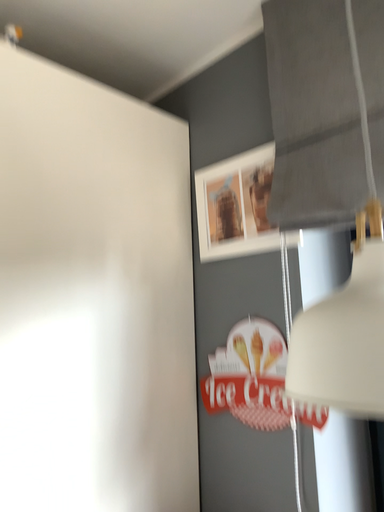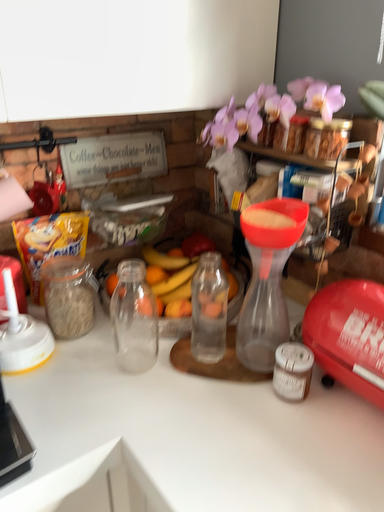
Question: How did the camera likely rotate when shooting the video?

Choices:
 (A) rotated downward
 (B) rotated upward

Answer: (A)